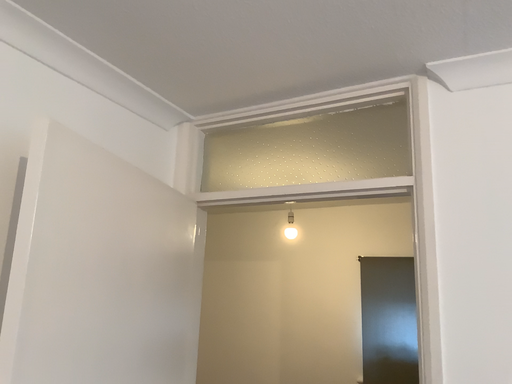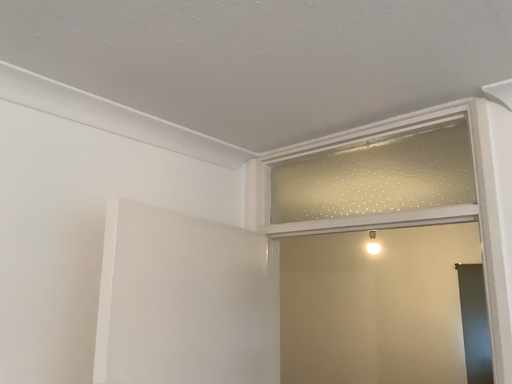
Question: How did the camera likely rotate when shooting the video?

Choices:
 (A) rotated right
 (B) rotated left

Answer: (B)